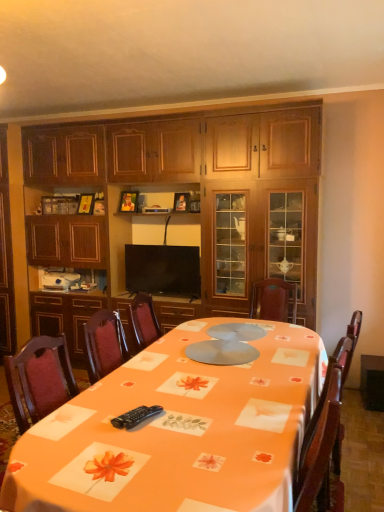
Locate an element on the screen. The image size is (384, 512). free spot to the left of black plastic remote control at lower center is located at coordinates (91, 421).